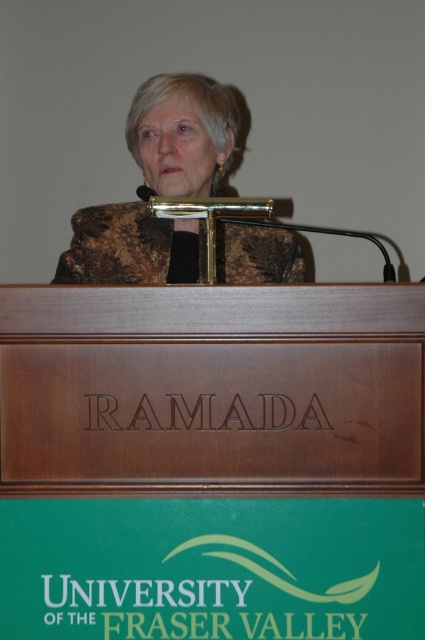
You are attending a university event and notice the brown polished wood podium at center and the brown textured jacket at center. From your perspective facing the stage, which object is positioned to the left?

The brown textured jacket at center is positioned to the left of the brown polished wood podium at center.

You are a photographer at the event and need to capture a clear shot of the brown polished wood podium at center and the brown textured jacket at center. Since the podium has the university banner, you want to ensure it is visible. Which object should be placed closer to the camera to achieve this?

The brown polished wood podium at center should be placed closer to the camera because it is in front of the brown textured jacket at center, allowing the podium to be more visible in the photo.